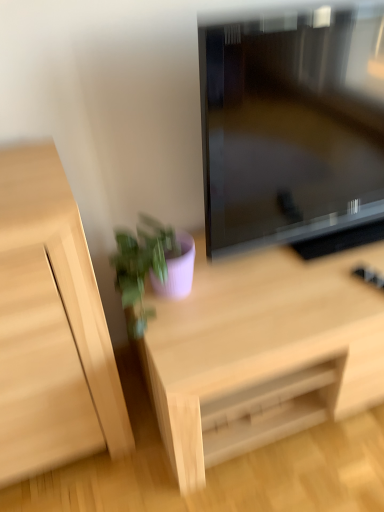
The height and width of the screenshot is (512, 384). I want to click on blank area beneath matte purple pot at lower center (from a real-world perspective), so click(x=164, y=305).